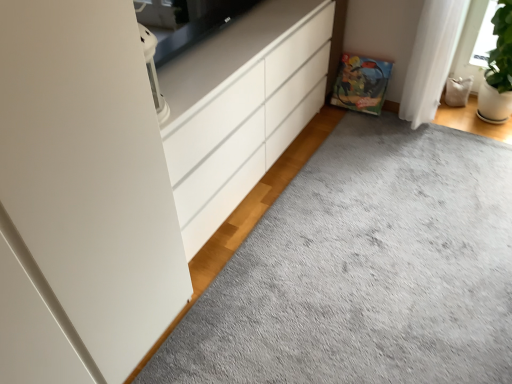
Question: Does white glossy chest of drawers at center appear on the right side of gray soft carpet at center?

Choices:
 (A) no
 (B) yes

Answer: (A)

Question: Considering the relative sizes of white glossy chest of drawers at center and gray soft carpet at center in the image provided, is white glossy chest of drawers at center thinner than gray soft carpet at center?

Choices:
 (A) no
 (B) yes

Answer: (B)

Question: Is white glossy chest of drawers at center taller than gray soft carpet at center?

Choices:
 (A) yes
 (B) no

Answer: (A)

Question: Is white glossy chest of drawers at center directly adjacent to gray soft carpet at center?

Choices:
 (A) no
 (B) yes

Answer: (A)

Question: Is gray soft carpet at center completely or partially inside white glossy chest of drawers at center?

Choices:
 (A) no
 (B) yes

Answer: (A)

Question: From the image's perspective, is white glossy chest of drawers at center under gray soft carpet at center?

Choices:
 (A) no
 (B) yes

Answer: (A)

Question: From a real-world perspective, is gray soft carpet at center positioned under white glossy chest of drawers at center based on gravity?

Choices:
 (A) yes
 (B) no

Answer: (A)

Question: From the image's perspective, would you say gray soft carpet at center is positioned over white glossy chest of drawers at center?

Choices:
 (A) no
 (B) yes

Answer: (A)

Question: Is gray soft carpet at center further to camera compared to white glossy chest of drawers at center?

Choices:
 (A) yes
 (B) no

Answer: (B)

Question: Is the depth of gray soft carpet at center less than that of white glossy chest of drawers at center?

Choices:
 (A) yes
 (B) no

Answer: (A)

Question: Is gray soft carpet at center aimed at white glossy chest of drawers at center?

Choices:
 (A) no
 (B) yes

Answer: (A)

Question: Is gray soft carpet at center touching white glossy chest of drawers at center?

Choices:
 (A) no
 (B) yes

Answer: (A)

Question: Is white glossy chest of drawers at center wider or thinner than gray soft carpet at center?

Choices:
 (A) thin
 (B) wide

Answer: (A)